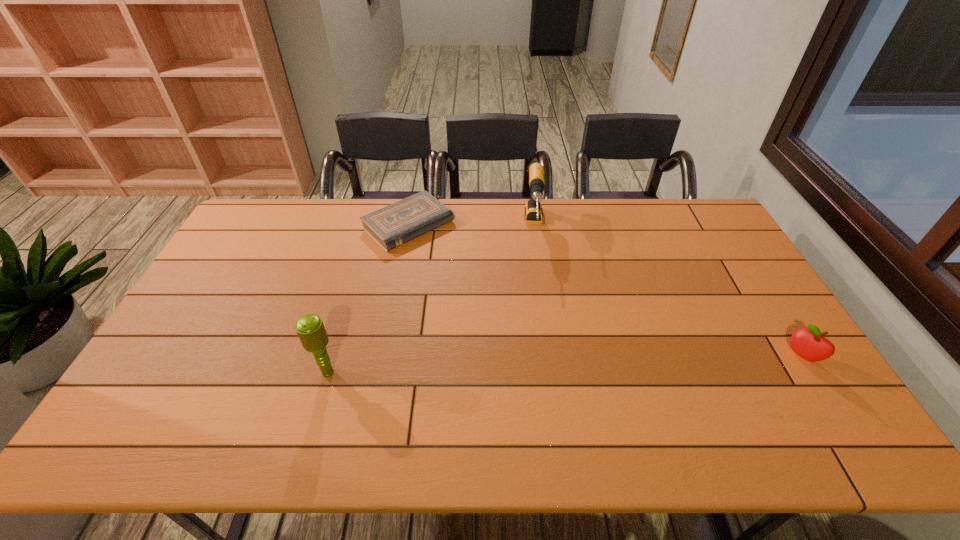
Locate an element on the screen. vacant area at the right edge is located at coordinates (711, 281).

You are a GUI agent. You are given a task and a screenshot of the screen. Output one action in this format:
    pyautogui.click(x=<x>, y=<y>)
    Task: Click on the free region at the far left corner
    
    Given the screenshot: What is the action you would take?
    pyautogui.click(x=272, y=237)

Locate an element on the screen. vacant space at the near left corner of the desktop is located at coordinates (131, 398).

In the image, there is a desktop. At what (x,y) coordinates should I click in order to perform the action: click on vacant region at the far right corner. Please return your answer as a coordinate pair (x, y). Looking at the image, I should click on (689, 222).

At what (x,y) coordinates should I click in order to perform the action: click on free space at the near right corner of the desktop. Please return your answer as a coordinate pair (x, y). Image resolution: width=960 pixels, height=540 pixels. Looking at the image, I should click on (804, 394).

Find the location of `free space between the microphone and the third tallest object`. free space between the microphone and the third tallest object is located at coordinates (564, 364).

You are a GUI agent. You are given a task and a screenshot of the screen. Output one action in this format:
    pyautogui.click(x=<x>, y=<y>)
    Task: Click on the vacant region between the second object from right to left and the Bible
    This screenshot has height=540, width=960.
    Given the screenshot: What is the action you would take?
    pyautogui.click(x=471, y=226)

Where is `free spot between the Bible and the microphone`? Image resolution: width=960 pixels, height=540 pixels. free spot between the Bible and the microphone is located at coordinates (368, 299).

Find the location of a particular element. free space between the second object from right to left and the microphone is located at coordinates (431, 300).

Where is `free point between the second object from right to left and the apple`? This screenshot has width=960, height=540. free point between the second object from right to left and the apple is located at coordinates (668, 292).